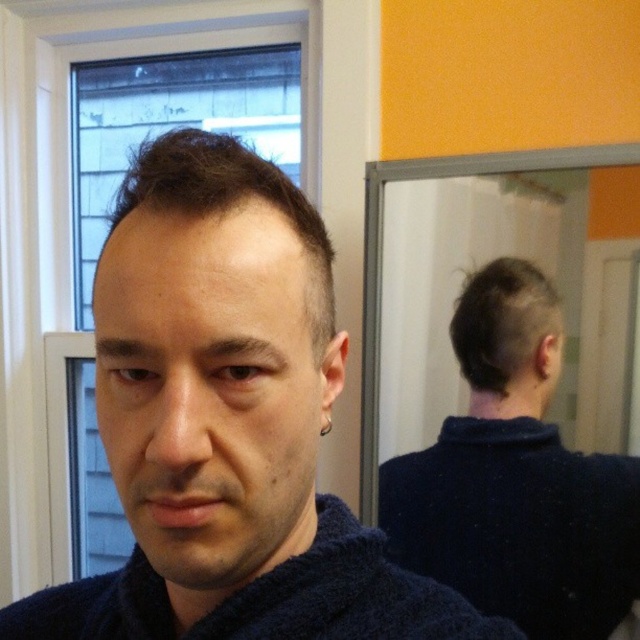
Does point (211, 612) come behind point (499, 362)?

No, it is not.

Locate an element on the screen. Image resolution: width=640 pixels, height=640 pixels. dark blue knitted bathrobe at center is located at coordinates [x=266, y=598].

Image resolution: width=640 pixels, height=640 pixels. Find the location of `dark blue knitted bathrobe at center`. dark blue knitted bathrobe at center is located at coordinates (266, 598).

Is dark blue sweater at back above dark matte hair at back?

No, dark blue sweater at back is not above dark matte hair at back.

Which is behind, point (604, 566) or point (481, 380)?

Positioned behind is point (604, 566).

Describe the element at coordinates (515, 477) in the screenshot. I see `dark blue sweater at back` at that location.

Locate an element on the screen. Image resolution: width=640 pixels, height=640 pixels. dark blue sweater at back is located at coordinates (515, 477).

Does dark brown textured hair at upper center have a greater width compared to dark matte hair at back?

In fact, dark brown textured hair at upper center might be narrower than dark matte hair at back.

Which is above, dark brown textured hair at upper center or dark matte hair at back?

Positioned higher is dark brown textured hair at upper center.

Does point (154, 140) lie behind point (515, 317)?

No, (154, 140) is in front of (515, 317).

Where is `dark brown textured hair at upper center`? The image size is (640, 640). dark brown textured hair at upper center is located at coordinates (228, 204).